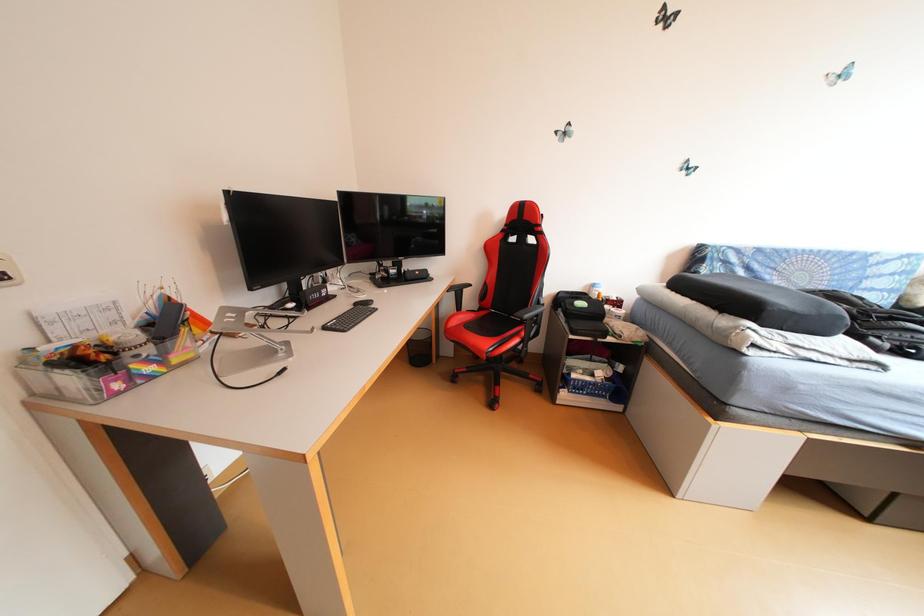
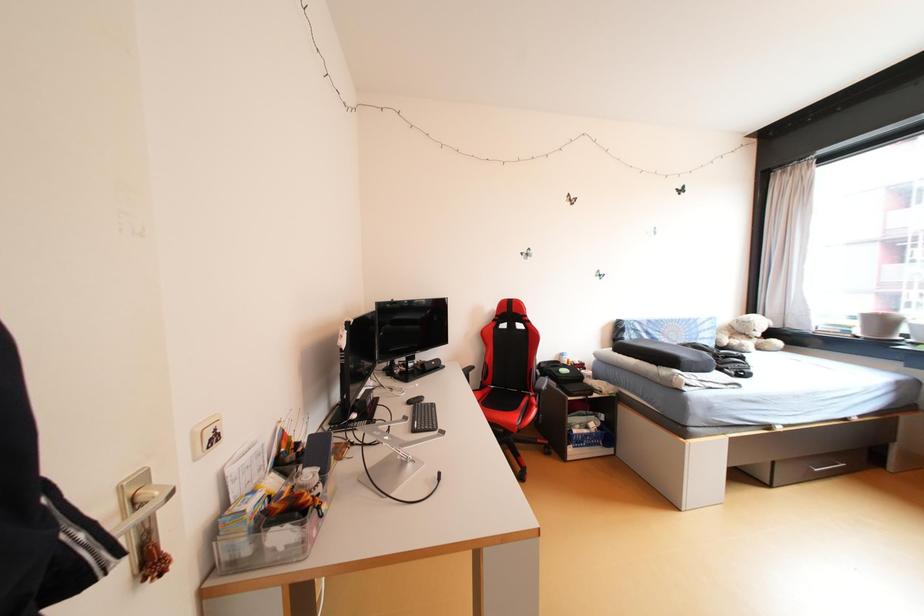
Question: The camera is either moving clockwise (left) or counter-clockwise (right) around the object. The first image is from the beginning of the video and the second image is from the end. Is the camera moving left or right when shooting the video?

Choices:
 (A) Left
 (B) Right

Answer: (A)